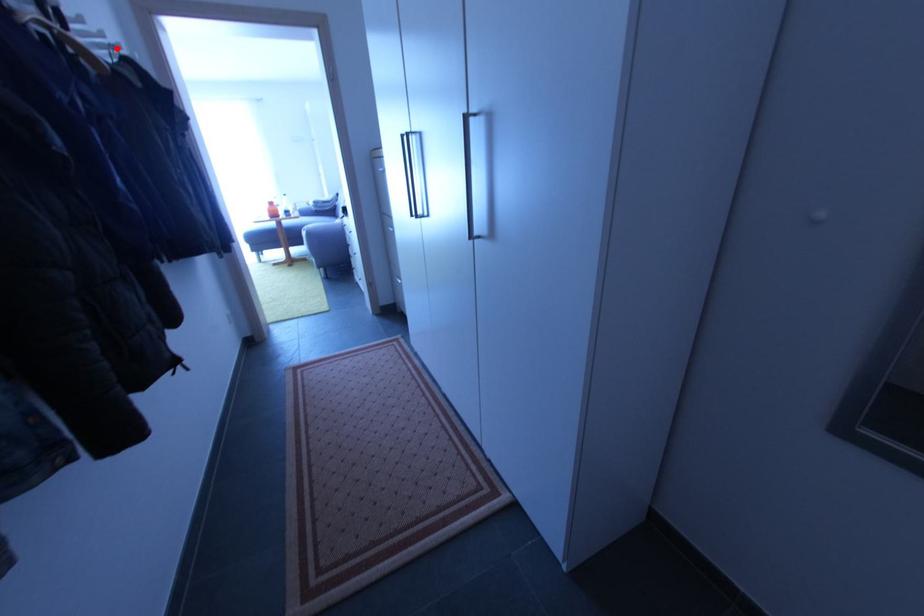
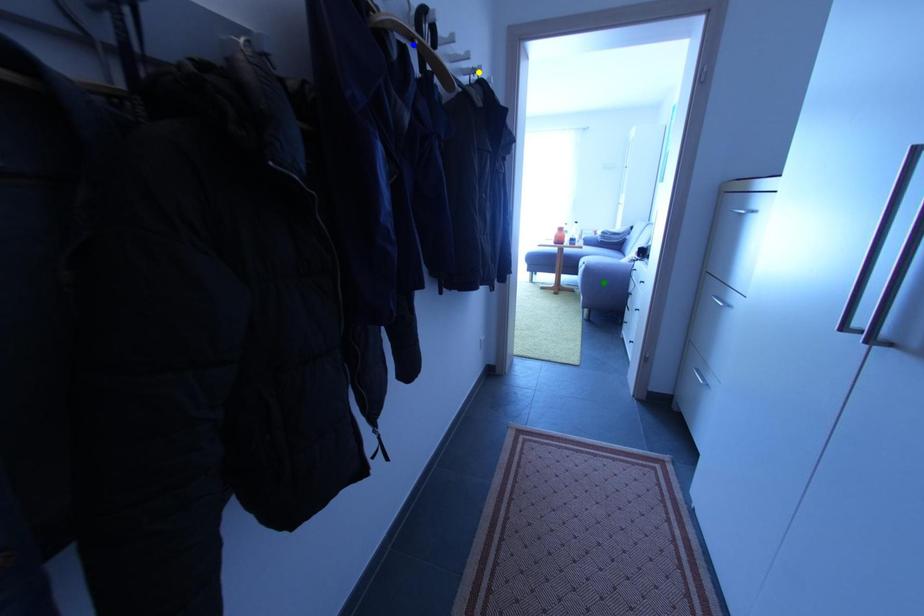
Question: I am providing you with two images of the same scene from different viewpoints. A red point is marked on the first image. You are given multiple points on the second image. Which mark in image 2 goes with the point in image 1?

Choices:
 (A) green point
 (B) blue point
 (C) yellow point

Answer: (C)